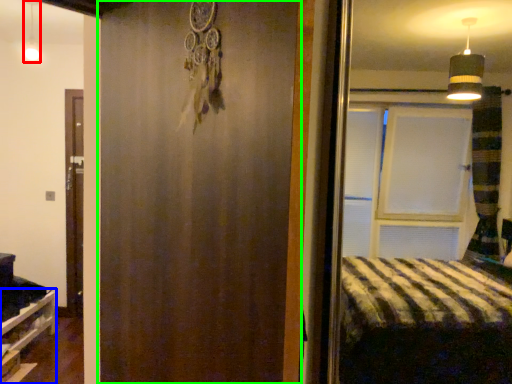
Question: Based on their relative distances, which object is nearer to light fixture (highlighted by a red box)? Choose from shelf (highlighted by a blue box) and barn door (highlighted by a green box).

Choices:
 (A) shelf
 (B) barn door

Answer: (A)